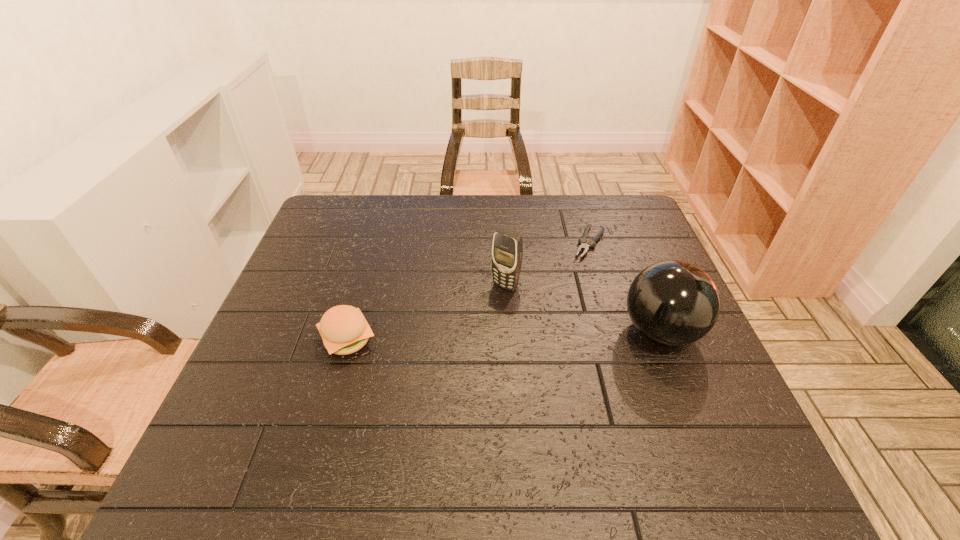
Image resolution: width=960 pixels, height=540 pixels. What are the coordinates of `vacant space at the near edge of the desktop` in the screenshot? It's located at (313, 419).

You are a GUI agent. You are given a task and a screenshot of the screen. Output one action in this format:
    pyautogui.click(x=<x>, y=<y>)
    Task: Click on the vacant space at the left edge
    
    Given the screenshot: What is the action you would take?
    pyautogui.click(x=264, y=374)

The width and height of the screenshot is (960, 540). I want to click on vacant region at the right edge of the desktop, so click(662, 352).

This screenshot has width=960, height=540. What are the coordinates of `free space between the leftmost object and the third nearest object` in the screenshot? It's located at (426, 313).

Locate an element on the screen. The width and height of the screenshot is (960, 540). free spot between the cellular telephone and the third tallest object is located at coordinates (426, 313).

Where is `free space between the leftmost object and the farthest object`? The width and height of the screenshot is (960, 540). free space between the leftmost object and the farthest object is located at coordinates (468, 292).

In order to click on unoccupied position between the third nearest object and the hamburger in this screenshot , I will do `click(426, 313)`.

At what (x,y) coordinates should I click in order to perform the action: click on free spot between the pliers and the bowling ball. Please return your answer as a coordinate pair (x, y). This screenshot has height=540, width=960. Looking at the image, I should click on (625, 287).

The height and width of the screenshot is (540, 960). Find the location of `free space between the farthest object and the bowling ball`. free space between the farthest object and the bowling ball is located at coordinates (625, 287).

The height and width of the screenshot is (540, 960). I want to click on free spot between the bowling ball and the second object from left to right, so click(x=583, y=309).